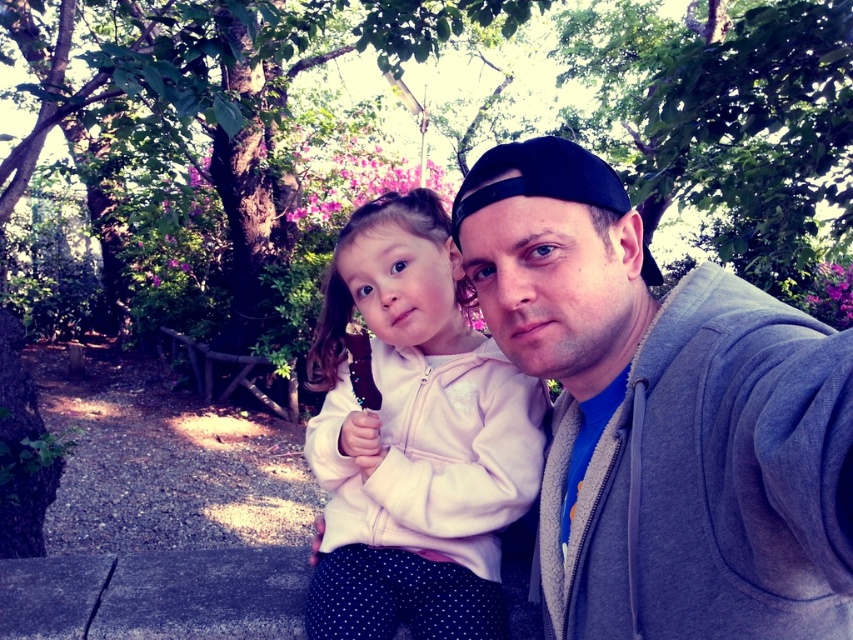
Who is taller, gray fleece jacket at center or white fleece jacket at center?

With more height is white fleece jacket at center.

Can you confirm if gray fleece jacket at center is thinner than white fleece jacket at center?

Yes, gray fleece jacket at center is thinner than white fleece jacket at center.

Between point (666, 304) and point (399, 458), which one is positioned behind?

The point (399, 458) is more distant.

Locate an element on the screen. The width and height of the screenshot is (853, 640). gray fleece jacket at center is located at coordinates (662, 416).